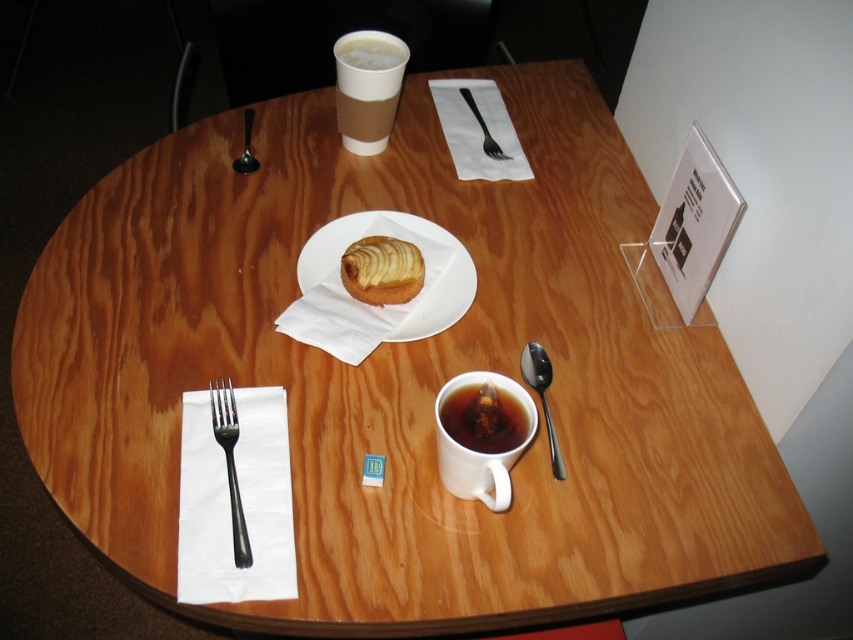
Who is more distant from viewer, (543, 374) or (480, 120)?

Point (480, 120)

Is point (550, 458) in front of point (495, 150)?

That is True.

You are a GUI agent. You are given a task and a screenshot of the screen. Output one action in this format:
    pyautogui.click(x=<x>, y=<y>)
    Task: Click on the satin silver spoon at right
    The height and width of the screenshot is (640, 853).
    Given the screenshot: What is the action you would take?
    pyautogui.click(x=543, y=396)

Is matte brown cup at upper center closer to the viewer compared to silver metallic fork at left?

No, it is behind silver metallic fork at left.

Does matte brown cup at upper center have a greater height compared to silver metallic fork at left?

Yes.

Who is more distant from viewer, (345, 58) or (241, 525)?

Positioned behind is point (345, 58).

You are a GUI agent. You are given a task and a screenshot of the screen. Output one action in this format:
    pyautogui.click(x=<x>, y=<y>)
    Task: Click on the matte brown cup at upper center
    This screenshot has height=640, width=853.
    Given the screenshot: What is the action you would take?
    pyautogui.click(x=367, y=88)

Does matte brown cup at upper center have a lesser width compared to satin silver spoon at right?

Incorrect, matte brown cup at upper center's width is not less than satin silver spoon at right's.

Does point (347, 36) come in front of point (531, 342)?

No.

The image size is (853, 640). What do you see at coordinates (367, 88) in the screenshot? I see `matte brown cup at upper center` at bounding box center [367, 88].

The height and width of the screenshot is (640, 853). In order to click on matte brown cup at upper center in this screenshot , I will do `click(367, 88)`.